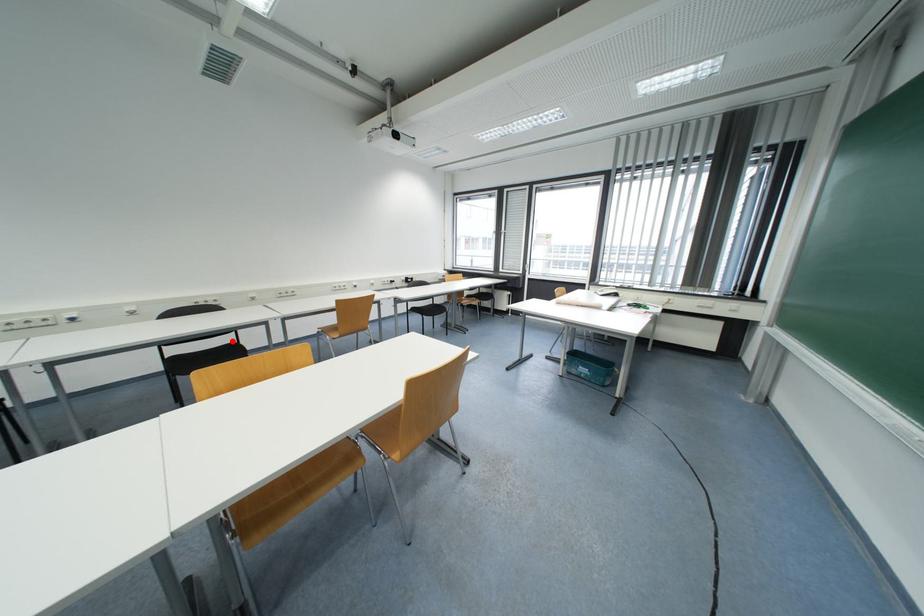
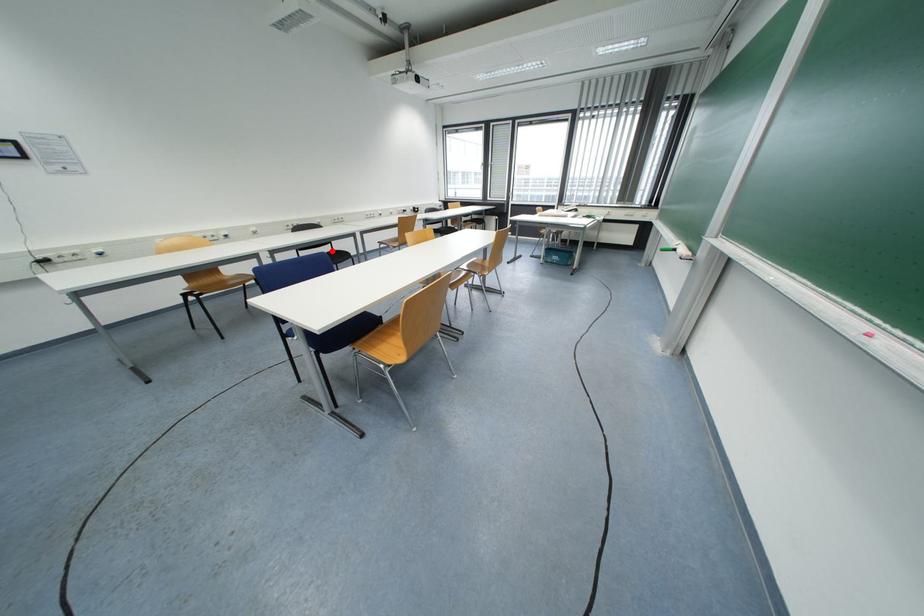
Consider the image. I am providing you with two images of the same scene from different viewpoints. A red point is marked on the first image and another point is marked on the second image. Is the red point in image1 aligned with the point shown in image2?

Yes